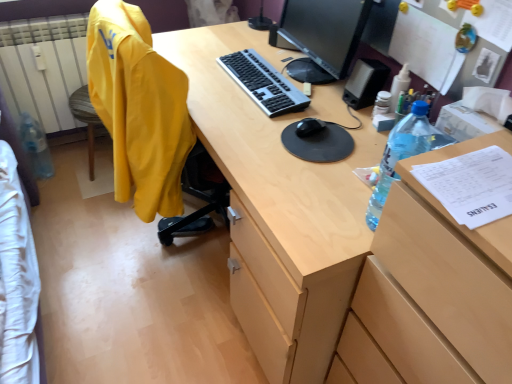
Question: Is translucent plastic bottle at right, placed as the first bottle when sorted from right to left, in front of or behind yellow fabric jacket at left, the 2th clothing viewed from the left, in the image?

Choices:
 (A) front
 (B) behind

Answer: (A)

Question: In terms of size, does translucent plastic bottle at right, which appears as the 2th bottle when viewed from the back, appear bigger or smaller than yellow fabric jacket at left, the 1th clothing from the right?

Choices:
 (A) big
 (B) small

Answer: (B)

Question: Estimate the real-world distances between objects in this image. Which object is farther from the white cotton bedsheet at lower left, acting as the first clothing starting from the left?

Choices:
 (A) matte wood desk at center
 (B) silver/black plastic keyboard at center
 (C) black glossy monitor at upper center
 (D) wooden file cabinet at right
 (E) translucent plastic bottle at right, which appears as the 2th bottle when viewed from the back

Answer: (C)

Question: Which object is positioned farthest from the yellow fabric computer chair at left?

Choices:
 (A) black matte mouse at center
 (B) wooden file cabinet at right
 (C) clear plastic bottle at left, which is counted as the first bottle, starting from the back
 (D) matte wood desk at center
 (E) translucent plastic bottle at right, placed as the first bottle when sorted from right to left

Answer: (B)